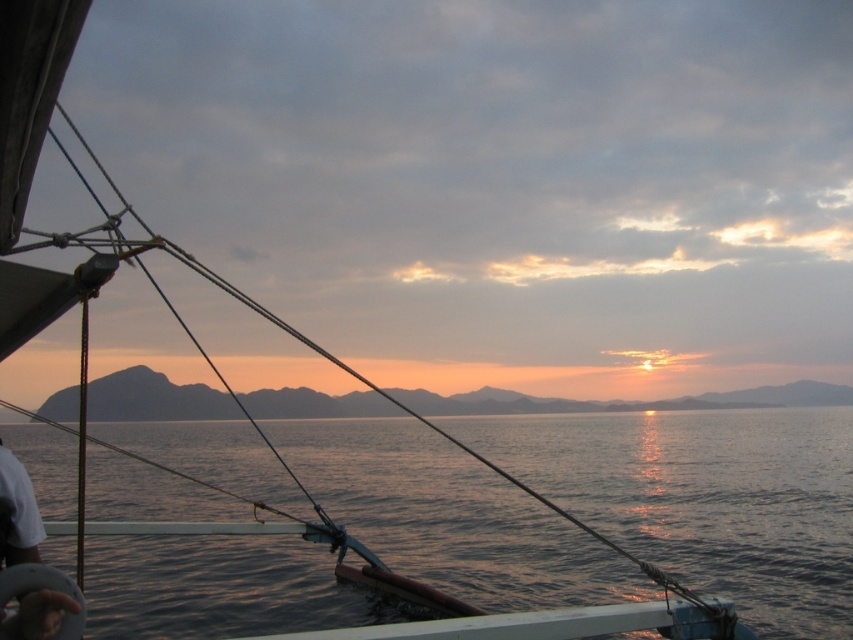
How much distance is there between dark blue water at center and silvery metallic horizon at center?

A distance of 56.02 meters exists between dark blue water at center and silvery metallic horizon at center.

Is dark blue water at center to the right of silvery metallic horizon at center from the viewer's perspective?

In fact, dark blue water at center is to the left of silvery metallic horizon at center.

Identify the location of dark blue water at center. (706, 499).